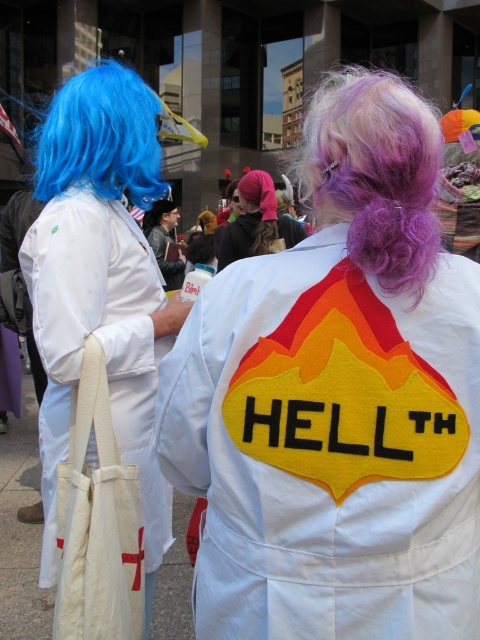
Question: Is white felt coat at center smaller than purple curly hair at upper center?

Choices:
 (A) no
 (B) yes

Answer: (B)

Question: Which of the following is the farthest from the observer?

Choices:
 (A) (395, 250)
 (B) (163, 209)
 (C) (166, 220)

Answer: (B)

Question: Which point is closer to the camera taking this photo?

Choices:
 (A) (173, 264)
 (B) (262, 243)

Answer: (B)

Question: Where is blue synthetic wig at left located in relation to dark gray fabric jacket at center in the image?

Choices:
 (A) left
 (B) right

Answer: (B)

Question: Which point is closer to the camera taking this photo?

Choices:
 (A) (334, 435)
 (B) (49, 109)
 (C) (239, 232)
 (D) (137, 108)

Answer: (A)

Question: Does blue synthetic wig at left have a greater width compared to dark gray fabric jacket at center?

Choices:
 (A) yes
 (B) no

Answer: (B)